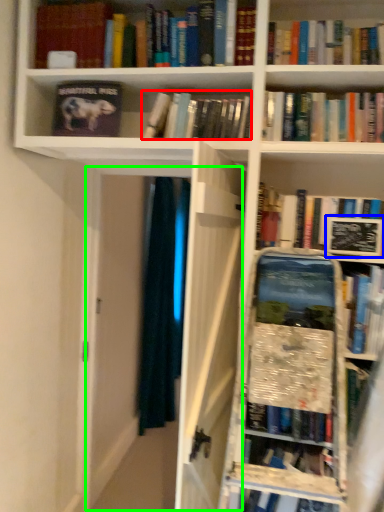
Question: Based on their relative distances, which object is nearer to book (highlighted by a red box)? Choose from paperback book (highlighted by a blue box) and glass door (highlighted by a green box).

Choices:
 (A) paperback book
 (B) glass door

Answer: (A)